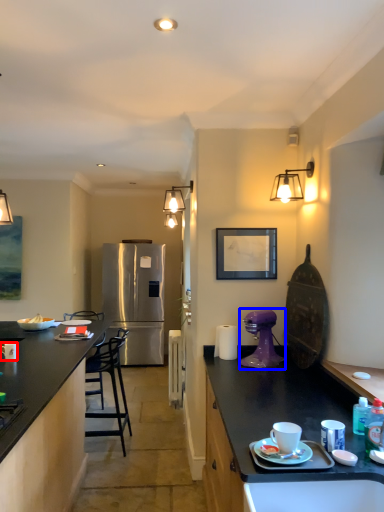
Question: Which of the following is the closest to the observer, coffee cup (highlighted by a red box) or coffee maker (highlighted by a blue box)?

Choices:
 (A) coffee cup
 (B) coffee maker

Answer: (B)